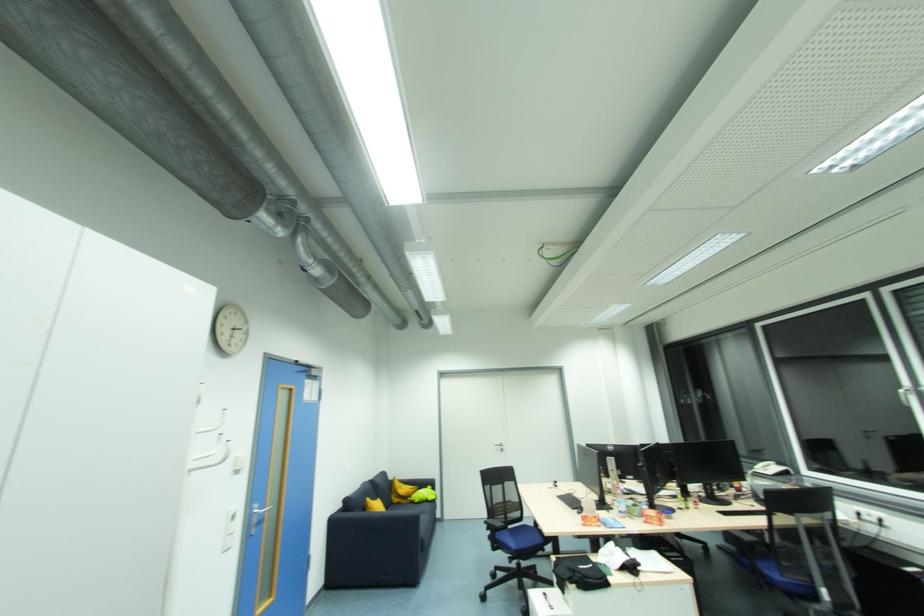
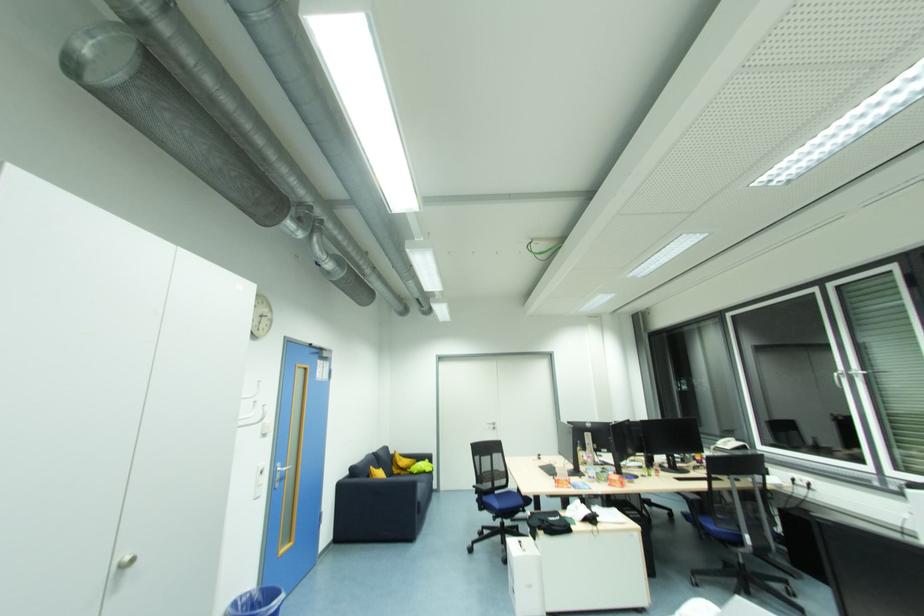
In the second image, find the point that corresponds to (x=367, y=511) in the first image.

(371, 477)